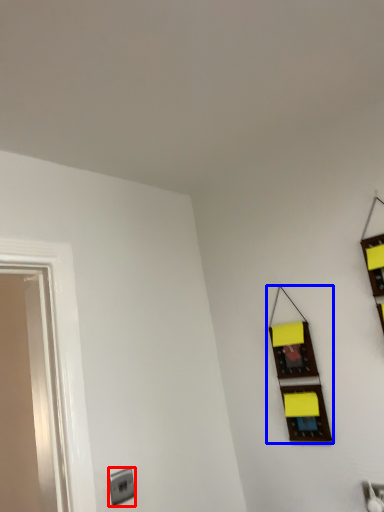
Question: Which object is further to the camera taking this photo, electric outlet (highlighted by a red box) or window (highlighted by a blue box)?

Choices:
 (A) electric outlet
 (B) window

Answer: (B)